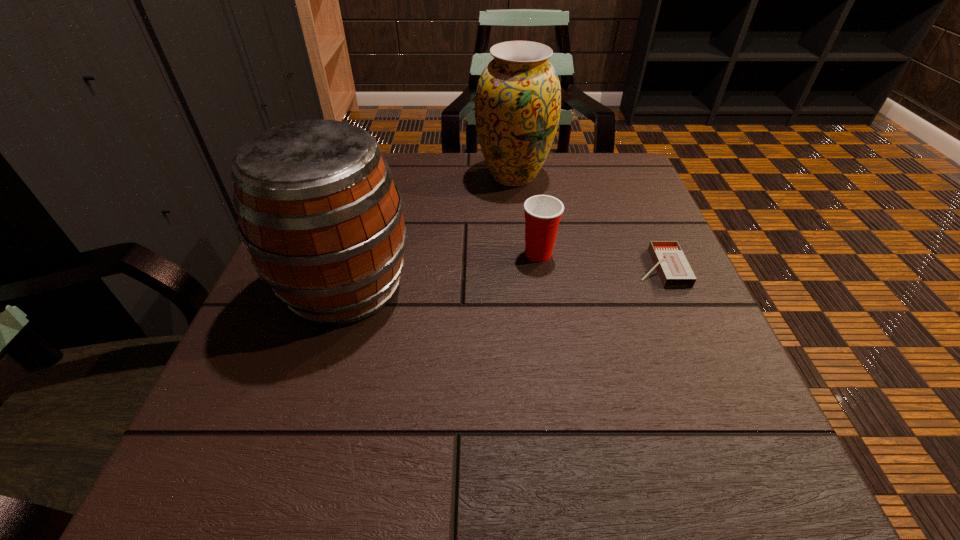
Locate an element on the screen. The width and height of the screenshot is (960, 540). the farthest object is located at coordinates (x=518, y=99).

Where is `the leftmost object`? This screenshot has width=960, height=540. the leftmost object is located at coordinates (318, 211).

At what (x,y) coordinates should I click in order to perform the action: click on the second shortest object. Please return your answer as a coordinate pair (x, y). The width and height of the screenshot is (960, 540). Looking at the image, I should click on (543, 213).

Find the location of a particular element. Image resolution: width=960 pixels, height=540 pixels. the shortest object is located at coordinates (668, 258).

Where is `the rightmost object`? This screenshot has height=540, width=960. the rightmost object is located at coordinates (668, 258).

At what (x,y) coordinates should I click in order to perform the action: click on free space located 0.090m on the front of the farthest object. Please return your answer as a coordinate pair (x, y). The image size is (960, 540). Looking at the image, I should click on (518, 220).

Identify the location of vacant area situated 0.050m on the right of the leftmost object. Image resolution: width=960 pixels, height=540 pixels. (439, 286).

Where is `free location located 0.300m on the left of the third tallest object`? The image size is (960, 540). free location located 0.300m on the left of the third tallest object is located at coordinates (372, 254).

This screenshot has width=960, height=540. Identify the location of vacant space located on the striking surface of the rightmost object. (514, 268).

Identify the location of blank space located on the striking surface of the rightmost object. (524, 268).